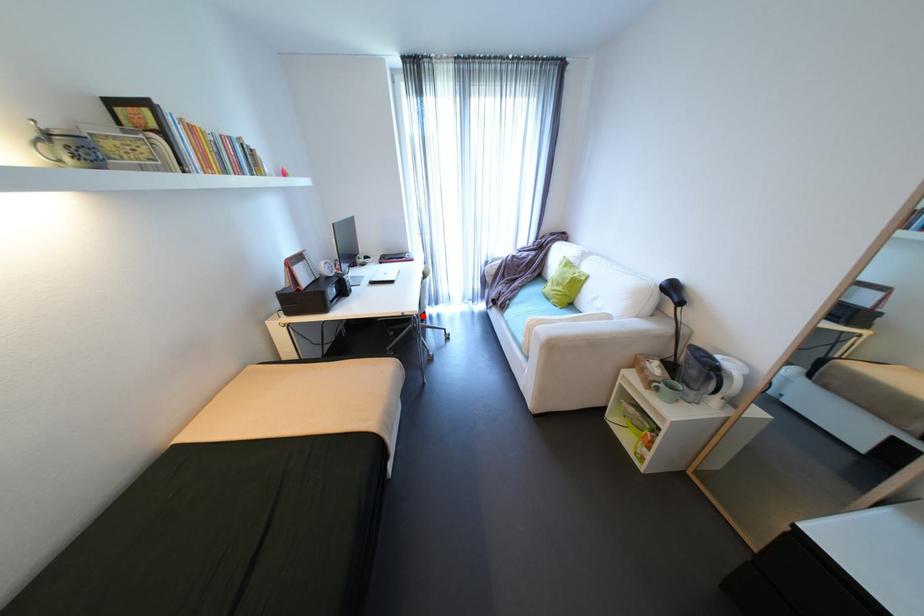
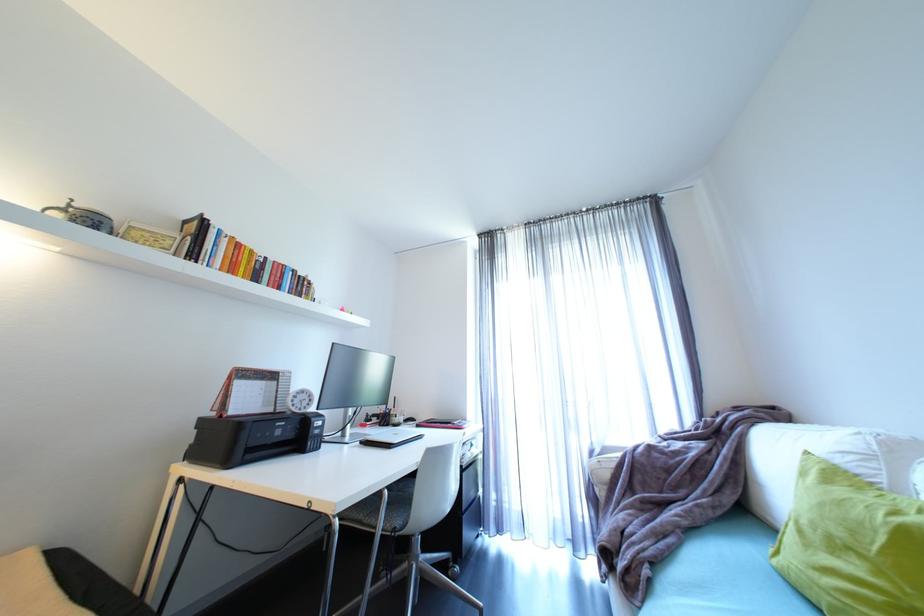
Question: I am providing you with two images of the same scene from different viewpoints. A red point is shown in image1. For the corresponding object point in image2, is it positioned nearer or farther from the camera?

Choices:
 (A) Nearer
 (B) Farther

Answer: (B)